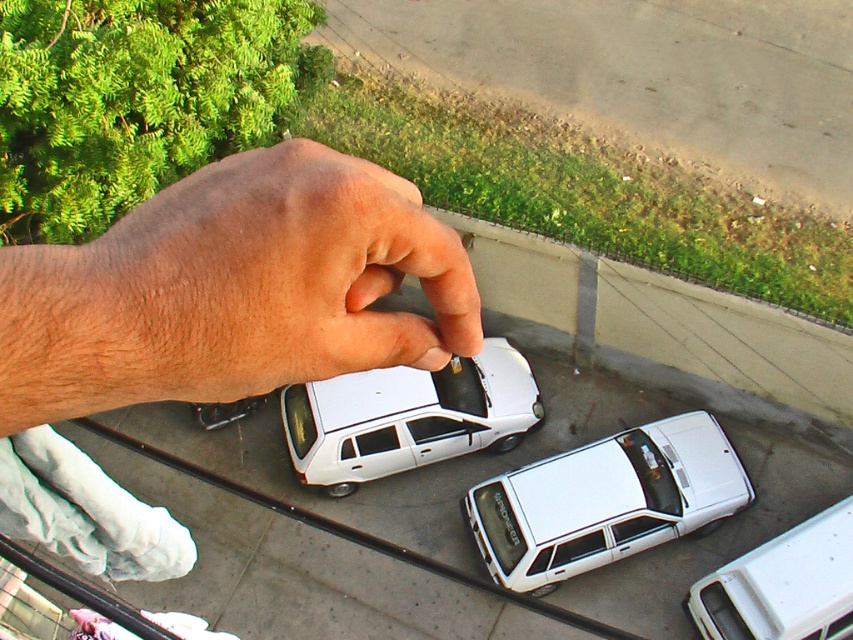
From the picture: You are a tiny explorer standing on the miniature street. You see the point at coordinates (605, 500). Which object is that point located on?

The point at coordinates (605, 500) is located on the white matte station wagon at center.

In the scene shown: You are a tiny person standing on the miniature street. You want to walk from the white matte car at lower right to the white matte station wagon at center. Which direction should you walk to get closer to the station wagon?

You should walk towards the center of the image because the white matte station wagon at center is closer to you than the white matte car at lower right.